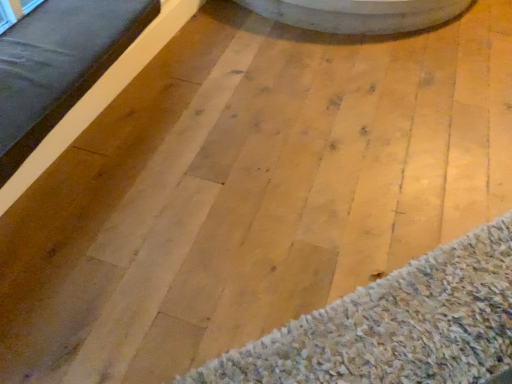
Question: Could you tell me if matte wood bed frame at left is facing woolen carpet at lower right?

Choices:
 (A) yes
 (B) no

Answer: (B)

Question: Is matte wood bed frame at left positioned far away from woolen carpet at lower right?

Choices:
 (A) yes
 (B) no

Answer: (A)

Question: Considering the relative sizes of matte wood bed frame at left and woolen carpet at lower right in the image provided, is matte wood bed frame at left wider than woolen carpet at lower right?

Choices:
 (A) yes
 (B) no

Answer: (A)

Question: From the image's perspective, is matte wood bed frame at left located beneath woolen carpet at lower right?

Choices:
 (A) no
 (B) yes

Answer: (A)

Question: From the image's perspective, is matte wood bed frame at left on top of woolen carpet at lower right?

Choices:
 (A) no
 (B) yes

Answer: (B)

Question: Can you confirm if matte wood bed frame at left is smaller than woolen carpet at lower right?

Choices:
 (A) yes
 (B) no

Answer: (B)

Question: From a real-world perspective, is woolen carpet at lower right on top of matte wood bed frame at left?

Choices:
 (A) yes
 (B) no

Answer: (B)

Question: Considering the relative sizes of woolen carpet at lower right and matte wood bed frame at left in the image provided, is woolen carpet at lower right thinner than matte wood bed frame at left?

Choices:
 (A) no
 (B) yes

Answer: (B)

Question: Is woolen carpet at lower right to the left of matte wood bed frame at left from the viewer's perspective?

Choices:
 (A) no
 (B) yes

Answer: (A)

Question: Is woolen carpet at lower right smaller than matte wood bed frame at left?

Choices:
 (A) no
 (B) yes

Answer: (B)

Question: Does woolen carpet at lower right have a greater width compared to matte wood bed frame at left?

Choices:
 (A) yes
 (B) no

Answer: (B)

Question: Does woolen carpet at lower right appear on the right side of matte wood bed frame at left?

Choices:
 (A) yes
 (B) no

Answer: (A)

Question: Is point (x=369, y=291) closer or farther from the camera than point (x=1, y=162)?

Choices:
 (A) farther
 (B) closer

Answer: (A)